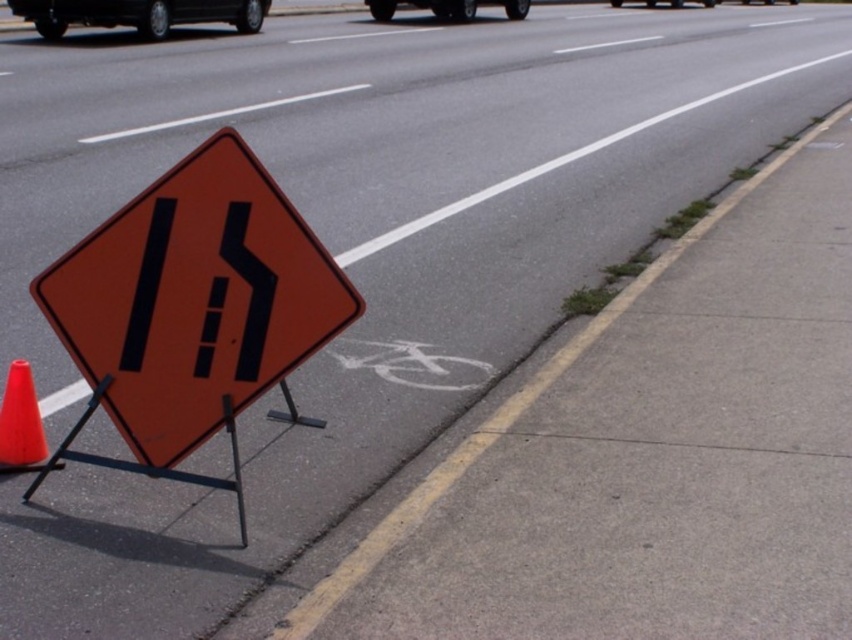
Does orange reflective plastic traffic sign at lower left have a lesser height compared to orange plastic traffic cone at lower left?

In fact, orange reflective plastic traffic sign at lower left may be taller than orange plastic traffic cone at lower left.

Which is in front, point (223, 298) or point (41, 435)?

Point (223, 298) is in front.

Where is `orange reflective plastic traffic sign at lower left`? The width and height of the screenshot is (852, 640). orange reflective plastic traffic sign at lower left is located at coordinates (194, 300).

Is orange plastic traffic cone at lower left closer to camera compared to black rubber car at center?

Yes, orange plastic traffic cone at lower left is closer to the viewer.

Who is positioned more to the left, orange plastic traffic cone at lower left or black rubber car at center?

Positioned to the left is orange plastic traffic cone at lower left.

What are the coordinates of `orange plastic traffic cone at lower left` in the screenshot? It's located at (20, 422).

Is point (266, 380) more distant than point (465, 17)?

No.

Is point (235, 168) positioned before point (436, 3)?

Yes.

At what (x,y) coordinates should I click in order to perform the action: click on orange reflective plastic traffic sign at lower left. Please return your answer as a coordinate pair (x, y). Looking at the image, I should click on (194, 300).